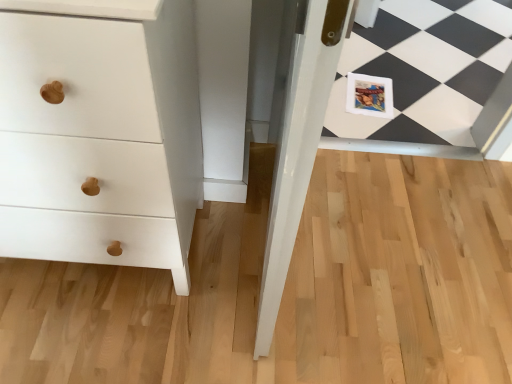
Question: From a real-world perspective, is matte paper postcard at center physically above white matte wood chest of drawers at left?

Choices:
 (A) yes
 (B) no

Answer: (B)

Question: Is matte paper postcard at center facing away from white matte wood chest of drawers at left?

Choices:
 (A) yes
 (B) no

Answer: (B)

Question: Can you confirm if matte paper postcard at center is taller than white matte wood chest of drawers at left?

Choices:
 (A) yes
 (B) no

Answer: (B)

Question: Is matte paper postcard at center far from white matte wood chest of drawers at left?

Choices:
 (A) no
 (B) yes

Answer: (B)

Question: Are matte paper postcard at center and white matte wood chest of drawers at left making contact?

Choices:
 (A) no
 (B) yes

Answer: (A)

Question: Can you confirm if matte paper postcard at center is shorter than white matte wood chest of drawers at left?

Choices:
 (A) no
 (B) yes

Answer: (B)

Question: Considering the relative sizes of white matte wood chest of drawers at left and matte paper postcard at center in the image provided, is white matte wood chest of drawers at left smaller than matte paper postcard at center?

Choices:
 (A) yes
 (B) no

Answer: (B)

Question: Is white matte wood chest of drawers at left thinner than matte paper postcard at center?

Choices:
 (A) no
 (B) yes

Answer: (A)

Question: Does white matte wood chest of drawers at left appear on the right side of matte paper postcard at center?

Choices:
 (A) no
 (B) yes

Answer: (A)

Question: Are white matte wood chest of drawers at left and matte paper postcard at center making contact?

Choices:
 (A) no
 (B) yes

Answer: (A)

Question: Is white matte wood chest of drawers at left facing towards matte paper postcard at center?

Choices:
 (A) no
 (B) yes

Answer: (A)

Question: From the image's perspective, is white matte wood chest of drawers at left below matte paper postcard at center?

Choices:
 (A) no
 (B) yes

Answer: (B)

Question: From a real-world perspective, relative to matte paper postcard at center, is white matte wood chest of drawers at left vertically above or below?

Choices:
 (A) below
 (B) above

Answer: (B)